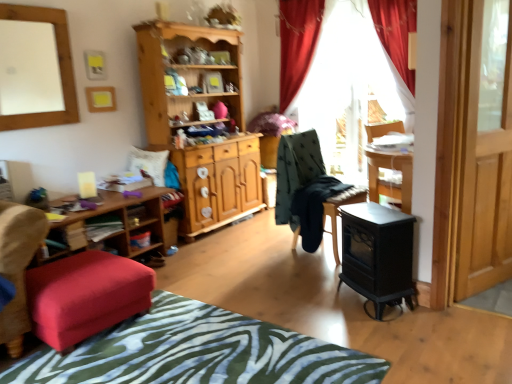
At what (x,y) coordinates should I click in order to perform the action: click on free space above white matte mirror at upper left (from a real-world perspective). Please return your answer as a coordinate pair (x, y). Looking at the image, I should click on (33, 2).